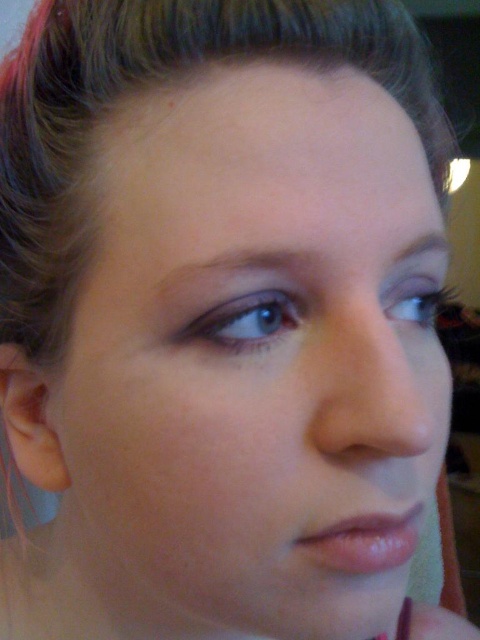
Who is lower down, smooth skin face at center or brown shiny hair at upper center?

smooth skin face at center

What do you see at coordinates (251, 355) in the screenshot? I see `smooth skin face at center` at bounding box center [251, 355].

Locate an element on the screen. This screenshot has height=640, width=480. smooth skin face at center is located at coordinates (251, 355).

How much distance is there between brown shiny hair at upper center and blue matte eye at upper left?

They are 4.29 inches apart.

Is brown shiny hair at upper center to the left of blue matte eye at upper left from the viewer's perspective?

Yes, brown shiny hair at upper center is to the left of blue matte eye at upper left.

Is point (61, 296) farther from camera compared to point (269, 324)?

Yes.

Where is `brown shiny hair at upper center`? brown shiny hair at upper center is located at coordinates (143, 88).

Is brown shiny hair at upper center positioned in front of shiny pink lipstick at lower center?

Yes, it is in front of shiny pink lipstick at lower center.

Between brown shiny hair at upper center and shiny pink lipstick at lower center, which one appears on the left side from the viewer's perspective?

From the viewer's perspective, brown shiny hair at upper center appears more on the left side.

The image size is (480, 640). In order to click on brown shiny hair at upper center in this screenshot , I will do `click(143, 88)`.